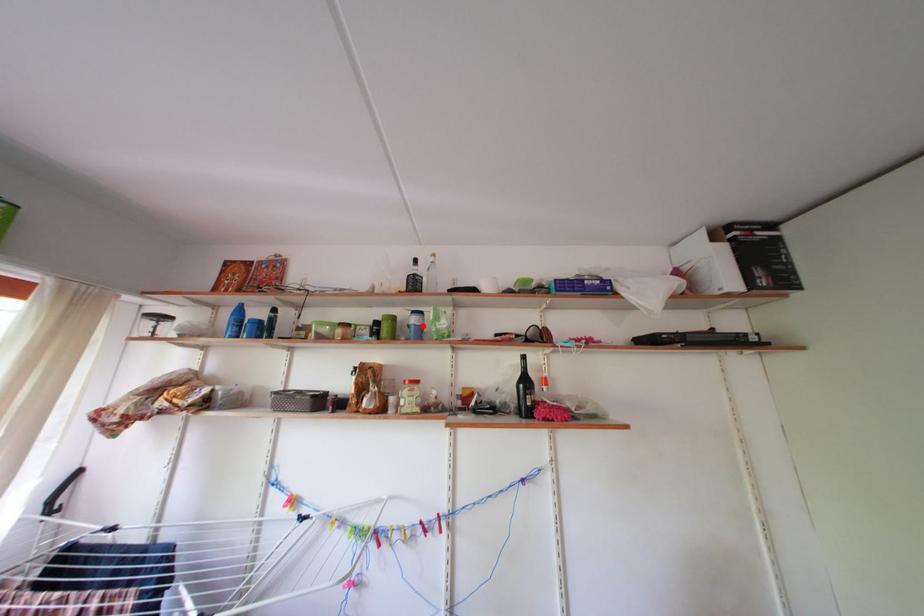
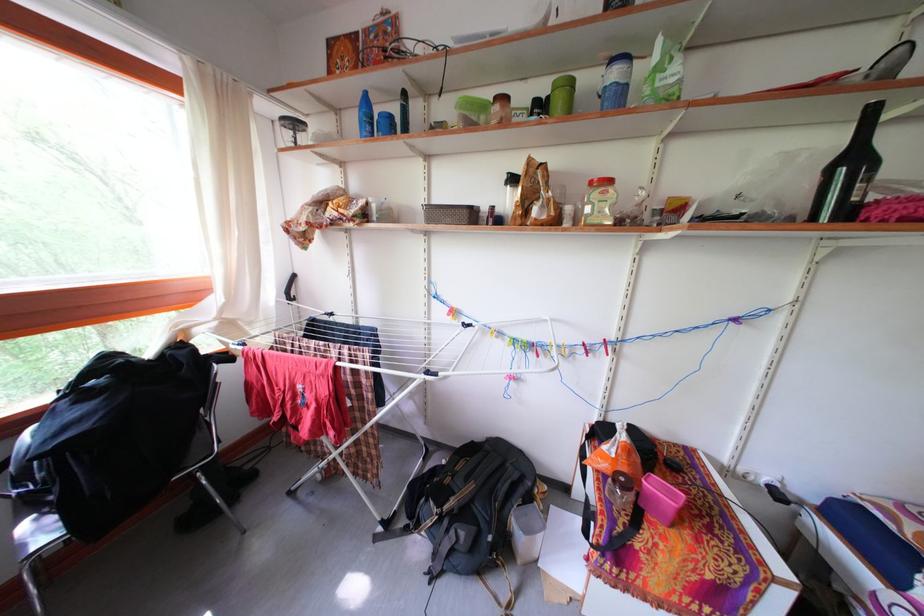
The point at the highlighted location is marked in the first image. Where is the corresponding point in the second image?

(623, 81)